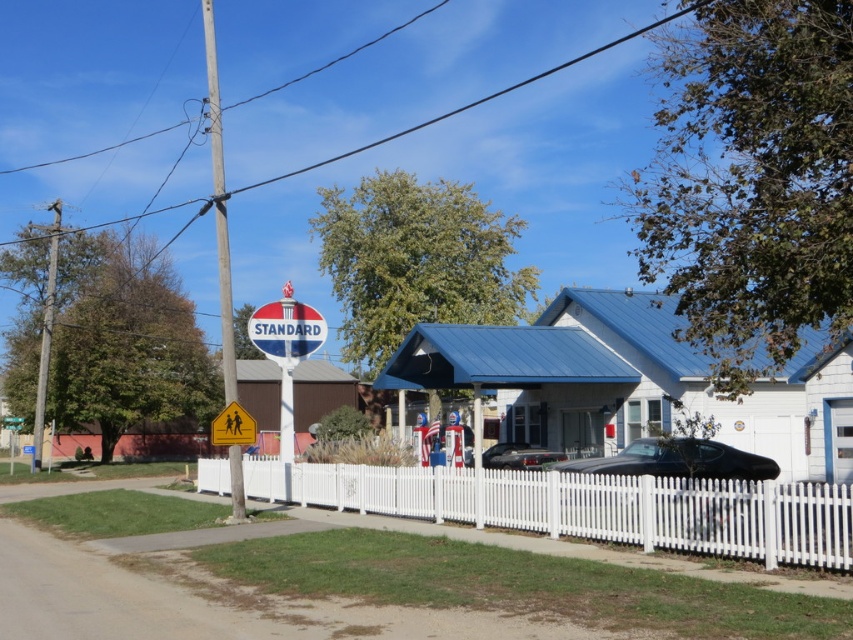
You are standing in front of the Standard Oil gas station and want to walk to the white picket fence at center. Which direction should you head relative to the wooden utility pole at center?

The white picket fence at center is on the right side of the wooden utility pole at center, so you should head to the right of the wooden utility pole at center to reach it.